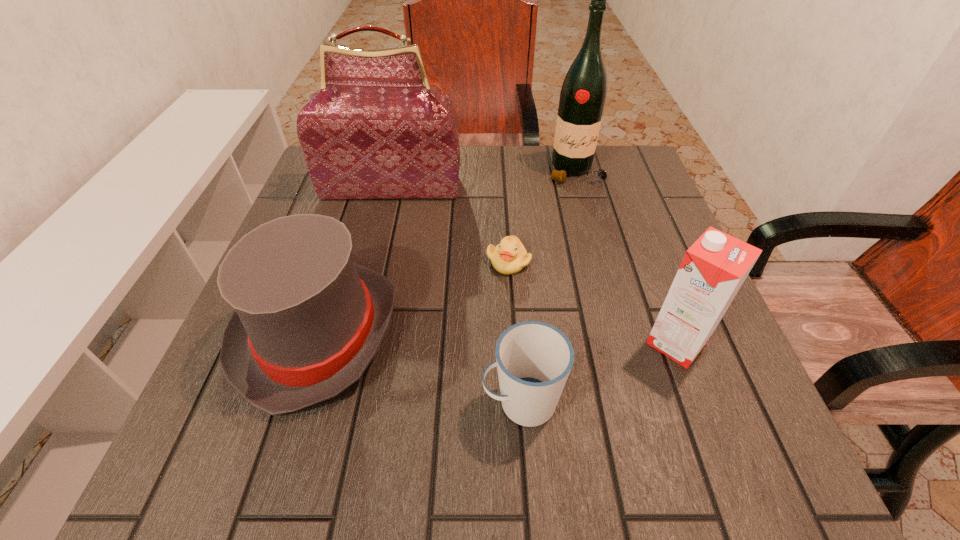
At what (x,y) coordinates should I click in order to perform the action: click on free space in the image that satisfies the following two spatial constraints: 1. at the face of the third tallest object; 2. on the left side of the duckling. Please return your answer as a coordinate pair (x, y). Looking at the image, I should click on (514, 342).

The image size is (960, 540). In order to click on free spot that satisfies the following two spatial constraints: 1. on the surface of the fourth shortest object; 2. on the right side of the wine bottle in this screenshot , I will do `click(622, 342)`.

The image size is (960, 540). What are the coordinates of `free point that satisfies the following two spatial constraints: 1. at the face of the third tallest object; 2. on the left side of the duckling` in the screenshot? It's located at (514, 342).

You are a GUI agent. You are given a task and a screenshot of the screen. Output one action in this format:
    pyautogui.click(x=<x>, y=<y>)
    Task: Click on the vacant area that satisfies the following two spatial constraints: 1. on the front side of the fourth tallest object; 2. on the right side of the carton
    Image resolution: width=960 pixels, height=540 pixels.
    Given the screenshot: What is the action you would take?
    pyautogui.click(x=316, y=342)

Where is `vacant area in the image that satisfies the following two spatial constraints: 1. on the surface of the fourth shortest object; 2. on the right side of the wine bottle`? vacant area in the image that satisfies the following two spatial constraints: 1. on the surface of the fourth shortest object; 2. on the right side of the wine bottle is located at coordinates (622, 342).

Where is `blank area in the image that satisfies the following two spatial constraints: 1. on the surface of the wine bottle; 2. with a handle on the side of the cup`? The width and height of the screenshot is (960, 540). blank area in the image that satisfies the following two spatial constraints: 1. on the surface of the wine bottle; 2. with a handle on the side of the cup is located at coordinates (638, 402).